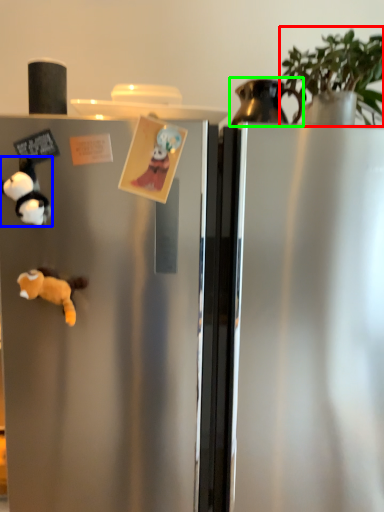
Question: Estimate the real-world distances between objects in this image. Which object is farther from plant (highlighted by a red box), toy (highlighted by a blue box) or appliance (highlighted by a green box)?

Choices:
 (A) toy
 (B) appliance

Answer: (A)